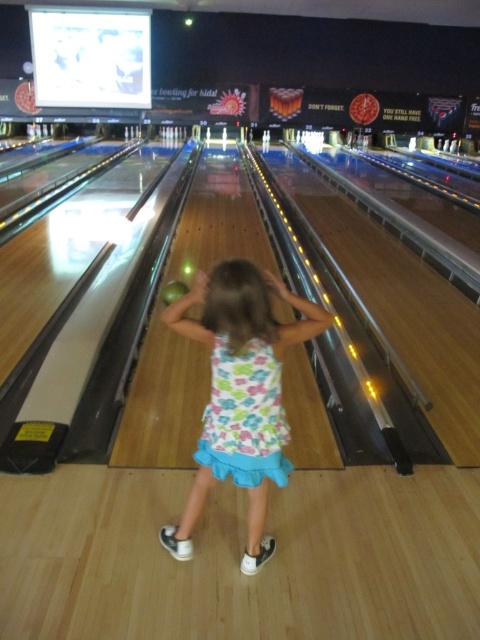
Between white floral dress at center and matte yellow bowling ball at center, which one is positioned higher?

matte yellow bowling ball at center is above.

Can you confirm if white floral dress at center is taller than matte yellow bowling ball at center?

Correct, white floral dress at center is much taller as matte yellow bowling ball at center.

Is point (178, 557) positioned before point (176, 296)?

Yes, point (178, 557) is closer to viewer.

This screenshot has width=480, height=640. Identify the location of white floral dress at center. (240, 394).

Can you confirm if floral cotton dress at center is taller than matte yellow bowling ball at center?

Yes.

Can you confirm if floral cotton dress at center is smaller than matte yellow bowling ball at center?

Correct, floral cotton dress at center occupies less space than matte yellow bowling ball at center.

Image resolution: width=480 pixels, height=640 pixels. In order to click on floral cotton dress at center in this screenshot , I will do `click(244, 417)`.

Locate an element on the screen. This screenshot has height=640, width=480. floral cotton dress at center is located at coordinates (244, 417).

Can you confirm if white floral dress at center is positioned to the right of floral cotton dress at center?

No, white floral dress at center is not to the right of floral cotton dress at center.

Who is lower down, white floral dress at center or floral cotton dress at center?

white floral dress at center

You are a GUI agent. You are given a task and a screenshot of the screen. Output one action in this format:
    pyautogui.click(x=<x>, y=<y>)
    Task: Click on the white floral dress at center
    The image size is (480, 640).
    Given the screenshot: What is the action you would take?
    pyautogui.click(x=240, y=394)